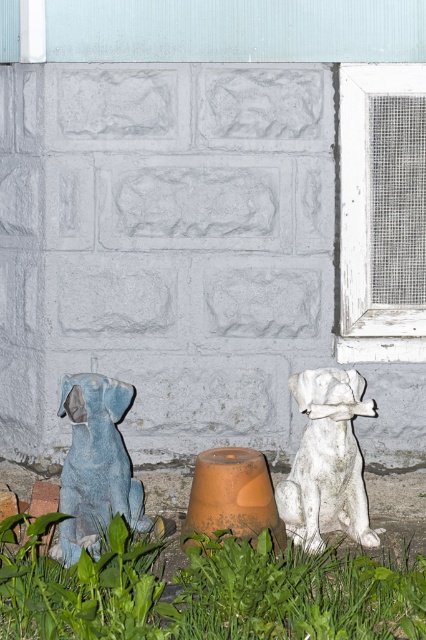
Question: Is green leafy grass at lower center smaller than white matte dog at center?

Choices:
 (A) no
 (B) yes

Answer: (A)

Question: Which of the following is the farthest from the observer?

Choices:
 (A) (354, 483)
 (B) (408, 572)
 (C) (103, 506)

Answer: (A)

Question: Is white matte dog at center closer to camera compared to matte blue statue at left?

Choices:
 (A) no
 (B) yes

Answer: (A)

Question: Among these objects, which one is farthest from the camera?

Choices:
 (A) matte blue statue at left
 (B) green leafy grass at lower center

Answer: (A)

Question: Does green leafy grass at lower center appear on the right side of matte blue statue at left?

Choices:
 (A) no
 (B) yes

Answer: (B)

Question: Which of the following is the closest to the observer?

Choices:
 (A) matte blue statue at left
 (B) green leafy grass at lower center

Answer: (B)